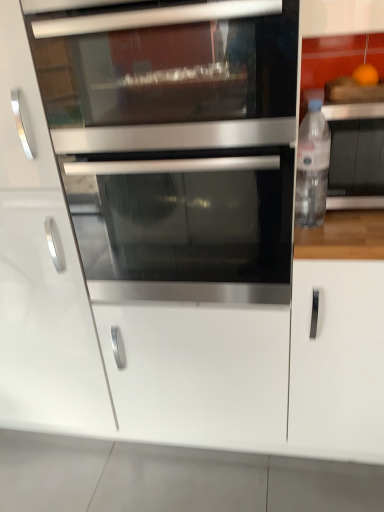
Question: Is white matte cabinet handle at right, which is the 1th cabinetry in right-to-left order, turned away from white matte drawer at center?

Choices:
 (A) yes
 (B) no

Answer: (B)

Question: Is white matte cabinet handle at right, marked as the second cabinetry in a left-to-right arrangement, at the right side of white matte drawer at center?

Choices:
 (A) no
 (B) yes

Answer: (B)

Question: Is white matte cabinet handle at right, marked as the second cabinetry in a left-to-right arrangement, at the left side of white matte drawer at center?

Choices:
 (A) yes
 (B) no

Answer: (B)

Question: Can you see white matte cabinet handle at right, which is the 1th cabinetry in right-to-left order, touching white matte drawer at center?

Choices:
 (A) no
 (B) yes

Answer: (A)

Question: Considering the relative sizes of white matte cabinet handle at right, marked as the second cabinetry in a left-to-right arrangement, and white matte drawer at center in the image provided, is white matte cabinet handle at right, marked as the second cabinetry in a left-to-right arrangement, smaller than white matte drawer at center?

Choices:
 (A) no
 (B) yes

Answer: (A)

Question: Which is correct: white glossy cabinet at center, the second cabinetry in the right-to-left sequence, is inside stainless steel microwave at center, or outside of it?

Choices:
 (A) inside
 (B) outside

Answer: (B)

Question: In terms of size, does white glossy cabinet at center, placed as the first cabinetry when sorted from left to right, appear bigger or smaller than stainless steel microwave at center?

Choices:
 (A) small
 (B) big

Answer: (B)

Question: Does point (74, 324) appear closer or farther from the camera than point (165, 86)?

Choices:
 (A) farther
 (B) closer

Answer: (A)

Question: Relative to stainless steel microwave at center, is white glossy cabinet at center, placed as the first cabinetry when sorted from left to right, in front or behind?

Choices:
 (A) front
 (B) behind

Answer: (B)

Question: Does point (150, 164) appear closer or farther from the camera than point (69, 415)?

Choices:
 (A) closer
 (B) farther

Answer: (A)

Question: Looking at the image, does stainless steel oven at center seem bigger or smaller compared to white glossy cabinet at center, placed as the first cabinetry when sorted from left to right?

Choices:
 (A) big
 (B) small

Answer: (B)

Question: From a real-world perspective, relative to white glossy cabinet at center, placed as the first cabinetry when sorted from left to right, is stainless steel oven at center vertically above or below?

Choices:
 (A) above
 (B) below

Answer: (A)

Question: From the image's perspective, is stainless steel oven at center positioned above or below white glossy cabinet at center, placed as the first cabinetry when sorted from left to right?

Choices:
 (A) below
 (B) above

Answer: (B)

Question: Considering the positions of white matte cabinet handle at right, which is the 1th cabinetry in right-to-left order, and clear plastic bottle at right in the image, is white matte cabinet handle at right, which is the 1th cabinetry in right-to-left order, wider or thinner than clear plastic bottle at right?

Choices:
 (A) thin
 (B) wide

Answer: (B)

Question: Is white matte cabinet handle at right, which is the 1th cabinetry in right-to-left order, taller or shorter than clear plastic bottle at right?

Choices:
 (A) short
 (B) tall

Answer: (B)